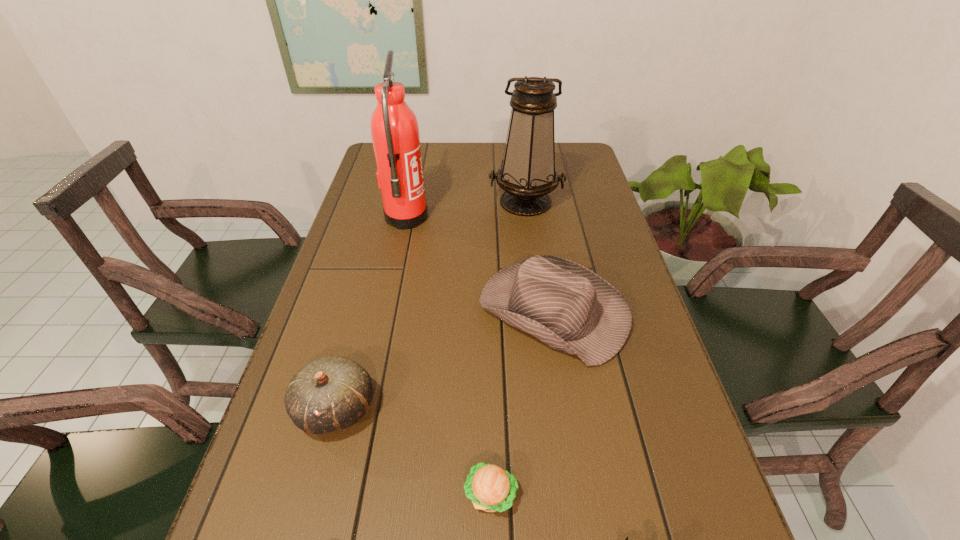
Locate an element on the screen. The height and width of the screenshot is (540, 960). fire extinguisher is located at coordinates 394,128.

Where is `the fifth shortest object`? the fifth shortest object is located at coordinates (527, 174).

Locate an element on the screen. The height and width of the screenshot is (540, 960). fedora is located at coordinates (570, 308).

Locate an element on the screen. gourd is located at coordinates (331, 393).

Where is `the shortest object`? the shortest object is located at coordinates (490, 488).

Where is `hamburger`? hamburger is located at coordinates (490, 488).

At what (x,y) coordinates should I click in order to perform the action: click on vacant region located on the label side of the fire extinguisher. Please return your answer as a coordinate pair (x, y). Looking at the image, I should click on (518, 218).

You are a GUI agent. You are given a task and a screenshot of the screen. Output one action in this format:
    pyautogui.click(x=<x>, y=<y>)
    Task: Click on the free space located on the back of the oil lamp
    The image size is (960, 540).
    Given the screenshot: What is the action you would take?
    pyautogui.click(x=521, y=170)

At what (x,y) coordinates should I click in order to perform the action: click on vacant region located on the left of the fedora. Please return your answer as a coordinate pair (x, y). Looking at the image, I should click on (385, 311).

Locate an element on the screen. blank area located on the front of the gourd is located at coordinates (304, 528).